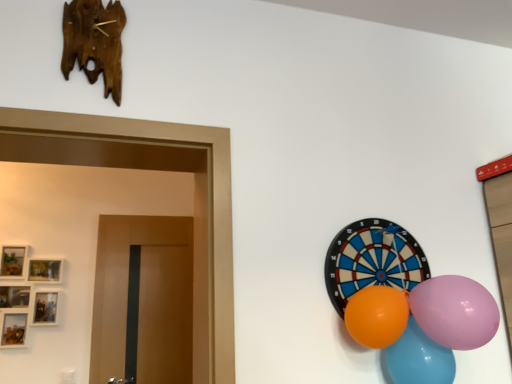
What are the coordinates of `shiny plastic balloons at lower right, acting as the first balloon starting from the right` in the screenshot? It's located at (419, 358).

Where is `rubber balloon at right`? rubber balloon at right is located at coordinates (372, 260).

Relative to rubber balloon at right, is shiny plastic balloons at lower right, acting as the first balloon starting from the right, in front or behind?

In the image, shiny plastic balloons at lower right, acting as the first balloon starting from the right, appears in front of rubber balloon at right.

Does shiny plastic balloons at lower right, the third balloon from the left, have a lesser width compared to rubber balloon at right?

No, shiny plastic balloons at lower right, the third balloon from the left, is not thinner than rubber balloon at right.

Is shiny plastic balloons at lower right, the third balloon from the left, positioned with its back to rubber balloon at right?

No, rubber balloon at right is not at the back of shiny plastic balloons at lower right, the third balloon from the left.

Measure the distance from shiny plastic balloons at lower right, acting as the first balloon starting from the right, to rubber balloon at right.

They are 25.70 centimeters apart.

Is pink glossy balloon at right, which appears as the second balloon when viewed from the right, taller than orange rubber balloon at right, the first balloon positioned from the left?

Indeed, pink glossy balloon at right, which appears as the second balloon when viewed from the right, has a greater height compared to orange rubber balloon at right, the first balloon positioned from the left.

Are pink glossy balloon at right, which appears as the second balloon when viewed from the right, and orange rubber balloon at right, the first balloon positioned from the left, far apart?

Actually, pink glossy balloon at right, which appears as the second balloon when viewed from the right, and orange rubber balloon at right, the first balloon positioned from the left, are a little close together.

Which is behind, pink glossy balloon at right, which is counted as the second balloon, starting from the left, or orange rubber balloon at right, the third balloon positioned from the right?

orange rubber balloon at right, the third balloon positioned from the right.

From a real-world perspective, is pink glossy balloon at right, which appears as the second balloon when viewed from the right, below orange rubber balloon at right, the first balloon positioned from the left?

Actually, pink glossy balloon at right, which appears as the second balloon when viewed from the right, is physically above orange rubber balloon at right, the first balloon positioned from the left, in the real world.

From the image's perspective, is rubber balloon at right positioned above or below orange rubber balloon at right, the first balloon positioned from the left?

Based on their image positions, rubber balloon at right is located above orange rubber balloon at right, the first balloon positioned from the left.

Identify the location of oval lying on the right of orange rubber balloon at right, the third balloon positioned from the right. (372, 260).

How many degrees apart are the facing directions of rubber balloon at right and orange rubber balloon at right, the third balloon positioned from the right?

The angle between the facing direction of rubber balloon at right and the facing direction of orange rubber balloon at right, the third balloon positioned from the right, is 0.000725 degrees.

Based on the photo, does rubber balloon at right appear on the left side of orange rubber balloon at right, the third balloon positioned from the right?

In fact, rubber balloon at right is to the right of orange rubber balloon at right, the third balloon positioned from the right.

Considering the relative positions of shiny plastic balloons at lower right, acting as the first balloon starting from the right, and orange rubber balloon at right, the third balloon positioned from the right, in the image provided, is shiny plastic balloons at lower right, acting as the first balloon starting from the right, to the left or to the right of orange rubber balloon at right, the third balloon positioned from the right,?

From the image, it's evident that shiny plastic balloons at lower right, acting as the first balloon starting from the right, is to the right of orange rubber balloon at right, the third balloon positioned from the right.

Looking at this image, from the image's perspective, does shiny plastic balloons at lower right, acting as the first balloon starting from the right, appear lower than orange rubber balloon at right, the first balloon positioned from the left?

Yes, from the image's perspective, shiny plastic balloons at lower right, acting as the first balloon starting from the right, is beneath orange rubber balloon at right, the first balloon positioned from the left.

Is shiny plastic balloons at lower right, acting as the first balloon starting from the right, positioned far away from orange rubber balloon at right, the first balloon positioned from the left?

No, there isn't a large distance between shiny plastic balloons at lower right, acting as the first balloon starting from the right, and orange rubber balloon at right, the first balloon positioned from the left.

Could you measure the distance between shiny plastic balloons at lower right, the third balloon from the left, and orange rubber balloon at right, the first balloon positioned from the left?

shiny plastic balloons at lower right, the third balloon from the left, is 10.55 centimeters away from orange rubber balloon at right, the first balloon positioned from the left.

Is shiny plastic balloons at lower right, the third balloon from the left, at the back of pink glossy balloon at right, which is counted as the second balloon, starting from the left?

No, pink glossy balloon at right, which is counted as the second balloon, starting from the left, is not facing away from shiny plastic balloons at lower right, the third balloon from the left.

Is point (450, 330) behind point (439, 358)?

No, it is in front of (439, 358).

Which object is further away from the camera taking this photo, pink glossy balloon at right, which appears as the second balloon when viewed from the right, or shiny plastic balloons at lower right, acting as the first balloon starting from the right?

shiny plastic balloons at lower right, acting as the first balloon starting from the right, is further away from the camera.

Visually, is pink glossy balloon at right, which appears as the second balloon when viewed from the right, positioned to the left or to the right of shiny plastic balloons at lower right, acting as the first balloon starting from the right?

pink glossy balloon at right, which appears as the second balloon when viewed from the right, is to the left of shiny plastic balloons at lower right, acting as the first balloon starting from the right.

Between rubber balloon at right and pink glossy balloon at right, which appears as the second balloon when viewed from the right, which one has smaller width?

Thinner between the two is rubber balloon at right.

Looking at the image, does rubber balloon at right seem bigger or smaller compared to pink glossy balloon at right, which is counted as the second balloon, starting from the left?

rubber balloon at right is smaller than pink glossy balloon at right, which is counted as the second balloon, starting from the left.

Identify the location of oval behind the pink glossy balloon at right, which is counted as the second balloon, starting from the left. (372, 260).

How many degrees apart are the facing directions of orange rubber balloon at right, the third balloon positioned from the right, and pink glossy balloon at right, which appears as the second balloon when viewed from the right?

0.00035 degrees separate the facing orientations of orange rubber balloon at right, the third balloon positioned from the right, and pink glossy balloon at right, which appears as the second balloon when viewed from the right.

Is point (362, 318) closer or farther from the camera than point (493, 328)?

Point (362, 318) is farther from the camera than point (493, 328).

Between orange rubber balloon at right, the first balloon positioned from the left, and pink glossy balloon at right, which appears as the second balloon when viewed from the right, which one is positioned behind?

orange rubber balloon at right, the first balloon positioned from the left, is behind.

Does orange rubber balloon at right, the third balloon positioned from the right, appear on the right side of pink glossy balloon at right, which is counted as the second balloon, starting from the left?

In fact, orange rubber balloon at right, the third balloon positioned from the right, is to the left of pink glossy balloon at right, which is counted as the second balloon, starting from the left.

Locate an element on the screen. The width and height of the screenshot is (512, 384). the 1st balloon in front when counting from the rubber balloon at right is located at coordinates (419, 358).

At what (x,y) coordinates should I click in order to perform the action: click on balloon on the left of pink glossy balloon at right, which is counted as the second balloon, starting from the left. Please return your answer as a coordinate pair (x, y). The height and width of the screenshot is (384, 512). Looking at the image, I should click on (377, 316).

Estimate the real-world distances between objects in this image. Which object is further from rubber balloon at right, orange rubber balloon at right, the third balloon positioned from the right, or shiny plastic balloons at lower right, the third balloon from the left?

shiny plastic balloons at lower right, the third balloon from the left, is positioned further to the anchor rubber balloon at right.

Looking at the image, which one is located closer to rubber balloon at right, orange rubber balloon at right, the first balloon positioned from the left, or pink glossy balloon at right, which is counted as the second balloon, starting from the left?

orange rubber balloon at right, the first balloon positioned from the left, is closer to rubber balloon at right.

Considering their positions, is rubber balloon at right positioned further to pink glossy balloon at right, which is counted as the second balloon, starting from the left, than shiny plastic balloons at lower right, acting as the first balloon starting from the right?

rubber balloon at right lies further to pink glossy balloon at right, which is counted as the second balloon, starting from the left, than the other object.

From the image, which object appears to be farther from pink glossy balloon at right, which appears as the second balloon when viewed from the right, shiny plastic balloons at lower right, acting as the first balloon starting from the right, or orange rubber balloon at right, the first balloon positioned from the left?

orange rubber balloon at right, the first balloon positioned from the left, is positioned further to the anchor pink glossy balloon at right, which appears as the second balloon when viewed from the right.

Estimate the real-world distances between objects in this image. Which object is further from rubber balloon at right, pink glossy balloon at right, which appears as the second balloon when viewed from the right, or orange rubber balloon at right, the first balloon positioned from the left?

Based on the image, pink glossy balloon at right, which appears as the second balloon when viewed from the right, appears to be further to rubber balloon at right.

Estimate the real-world distances between objects in this image. Which object is further from orange rubber balloon at right, the first balloon positioned from the left, rubber balloon at right or pink glossy balloon at right, which is counted as the second balloon, starting from the left?

The object further to orange rubber balloon at right, the first balloon positioned from the left, is rubber balloon at right.

Which object lies nearer to the anchor point rubber balloon at right, shiny plastic balloons at lower right, acting as the first balloon starting from the right, or pink glossy balloon at right, which is counted as the second balloon, starting from the left?

pink glossy balloon at right, which is counted as the second balloon, starting from the left.

Estimate the real-world distances between objects in this image. Which object is closer to orange rubber balloon at right, the first balloon positioned from the left, shiny plastic balloons at lower right, acting as the first balloon starting from the right, or pink glossy balloon at right, which is counted as the second balloon, starting from the left?

shiny plastic balloons at lower right, acting as the first balloon starting from the right, is positioned closer to the anchor orange rubber balloon at right, the first balloon positioned from the left.

This screenshot has height=384, width=512. In order to click on balloon situated between orange rubber balloon at right, the third balloon positioned from the right, and shiny plastic balloons at lower right, the third balloon from the left, from left to right in this screenshot , I will do `click(455, 311)`.